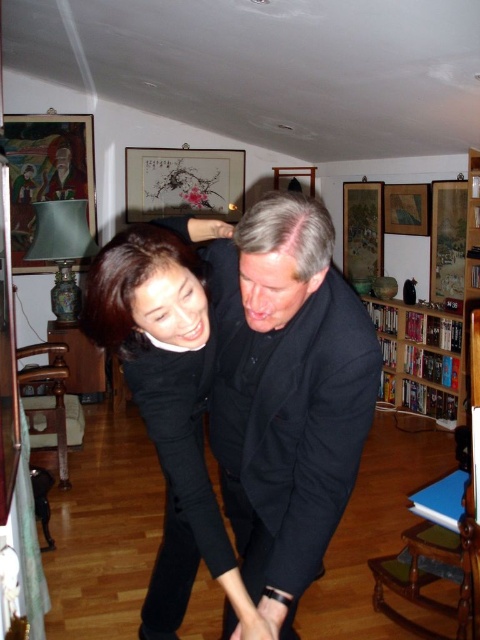
Can you confirm if black matte suit at center is positioned above black matte dress at center?

Yes, black matte suit at center is above black matte dress at center.

Does point (245, 369) come farther from viewer compared to point (217, 522)?

No, (245, 369) is in front of (217, 522).

Locate an element on the screen. black matte suit at center is located at coordinates (287, 394).

Who is lower down, black matte dress at center or wooden bookshelf at right?

black matte dress at center is lower down.

This screenshot has width=480, height=640. Describe the element at coordinates (168, 406) in the screenshot. I see `black matte dress at center` at that location.

This screenshot has width=480, height=640. What do you see at coordinates (168, 406) in the screenshot? I see `black matte dress at center` at bounding box center [168, 406].

This screenshot has width=480, height=640. Identify the location of black matte dress at center. (168, 406).

The image size is (480, 640). What do you see at coordinates (287, 394) in the screenshot?
I see `black matte suit at center` at bounding box center [287, 394].

Can you confirm if black matte suit at center is taller than wooden bookshelf at right?

Indeed, black matte suit at center has a greater height compared to wooden bookshelf at right.

Who is more distant from viewer, [252,424] or [456,364]?

The point [456,364] is behind.

Identify the location of black matte suit at center. (287, 394).